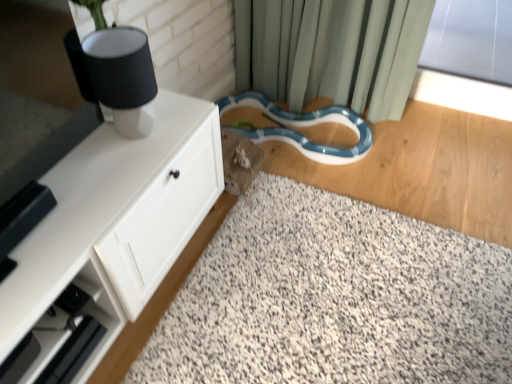
Question: Considering the relative sizes of white speckled carpet at center and blue glossy snake at lower center in the image provided, is white speckled carpet at center thinner than blue glossy snake at lower center?

Choices:
 (A) yes
 (B) no

Answer: (B)

Question: From the image's perspective, is white speckled carpet at center on blue glossy snake at lower center?

Choices:
 (A) no
 (B) yes

Answer: (A)

Question: Does white speckled carpet at center have a smaller size compared to blue glossy snake at lower center?

Choices:
 (A) no
 (B) yes

Answer: (A)

Question: Can you confirm if white speckled carpet at center is bigger than blue glossy snake at lower center?

Choices:
 (A) no
 (B) yes

Answer: (B)

Question: Is white speckled carpet at center positioned in front of blue glossy snake at lower center?

Choices:
 (A) no
 (B) yes

Answer: (B)

Question: Considering the relative sizes of white speckled carpet at center and blue glossy snake at lower center in the image provided, is white speckled carpet at center taller than blue glossy snake at lower center?

Choices:
 (A) no
 (B) yes

Answer: (B)

Question: From a real-world perspective, is white matte cabinet at left under blue glossy snake at lower center?

Choices:
 (A) no
 (B) yes

Answer: (A)

Question: Considering the relative sizes of white matte cabinet at left and blue glossy snake at lower center in the image provided, is white matte cabinet at left thinner than blue glossy snake at lower center?

Choices:
 (A) yes
 (B) no

Answer: (A)

Question: From the image's perspective, would you say white matte cabinet at left is shown under blue glossy snake at lower center?

Choices:
 (A) yes
 (B) no

Answer: (A)

Question: Is white matte cabinet at left not near blue glossy snake at lower center?

Choices:
 (A) no
 (B) yes

Answer: (A)

Question: Is white matte cabinet at left facing towards blue glossy snake at lower center?

Choices:
 (A) yes
 (B) no

Answer: (B)

Question: Is white matte cabinet at left looking in the opposite direction of blue glossy snake at lower center?

Choices:
 (A) no
 (B) yes

Answer: (A)

Question: Is black matte table lamp at upper left not within blue glossy snake at lower center?

Choices:
 (A) no
 (B) yes

Answer: (B)